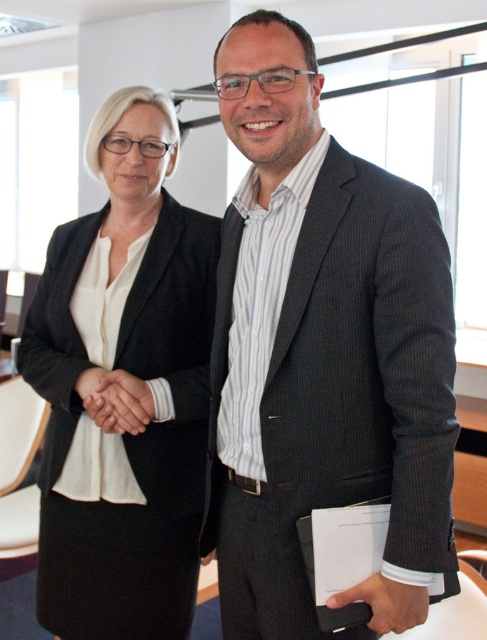
You are a photographer setting up for a professional photoshoot. You have a matte black skirt at lower left and a smooth skin handshake at center in your frame. Which object takes up more space in the photo?

The matte black skirt at lower left is bigger than the smooth skin handshake at center, so it takes up more space in the photo.

You are a security guard checking items in an office. You see the dark gray suit at center and the black leather wallet at lower center. Which item is taller?

The dark gray suit at center is taller than the black leather wallet at lower center.